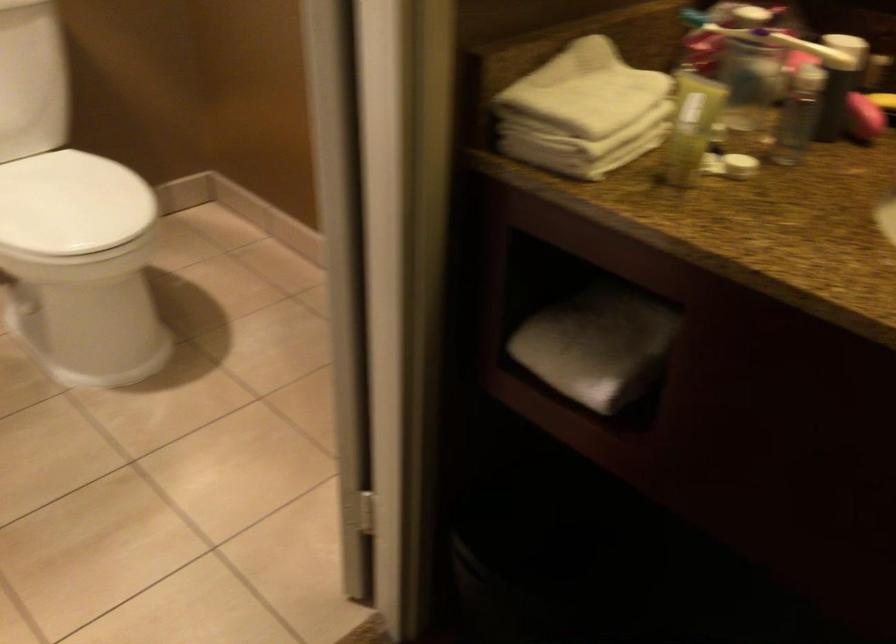
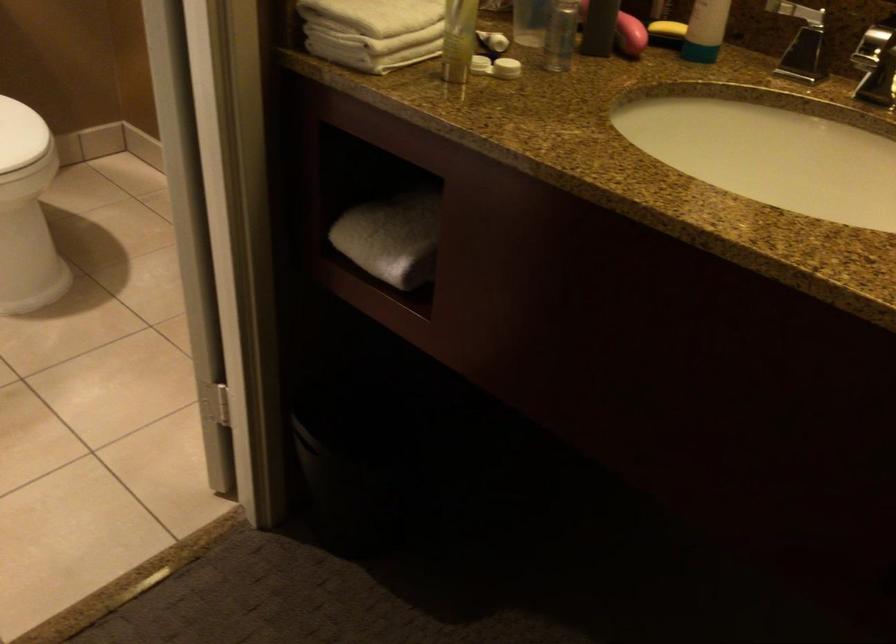
Locate, in the second image, the point that corresponds to (126,205) in the first image.

(20, 135)